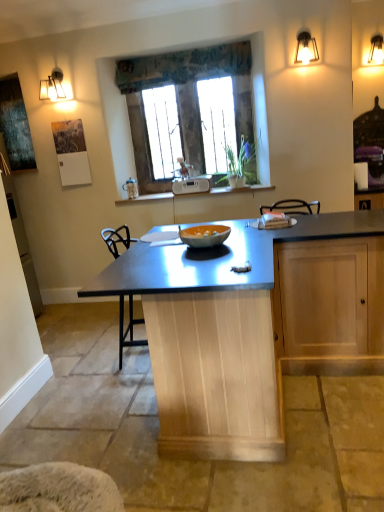
Question: Is stone textured window at center looking in the opposite direction of metallic wall sconce at upper right?

Choices:
 (A) yes
 (B) no

Answer: (B)

Question: Is stone textured window at center further to the viewer compared to metallic wall sconce at upper right?

Choices:
 (A) yes
 (B) no

Answer: (A)

Question: Is stone textured window at center thinner than metallic wall sconce at upper right?

Choices:
 (A) yes
 (B) no

Answer: (A)

Question: From a real-world perspective, does stone textured window at center sit lower than metallic wall sconce at upper right?

Choices:
 (A) yes
 (B) no

Answer: (A)

Question: Is stone textured window at center surrounding metallic wall sconce at upper right?

Choices:
 (A) yes
 (B) no

Answer: (B)

Question: From their relative heights in the image, would you say textured fabric valance at upper center is taller or shorter than white plastic radio at center?

Choices:
 (A) tall
 (B) short

Answer: (A)

Question: Based on their sizes in the image, would you say textured fabric valance at upper center is bigger or smaller than white plastic radio at center?

Choices:
 (A) small
 (B) big

Answer: (B)

Question: From a real-world perspective, relative to white plastic radio at center, is textured fabric valance at upper center vertically above or below?

Choices:
 (A) above
 (B) below

Answer: (A)

Question: In the image, is textured fabric valance at upper center positioned in front of or behind white plastic radio at center?

Choices:
 (A) behind
 (B) front

Answer: (B)

Question: In terms of size, does textured fabric valance at upper center appear bigger or smaller than orange matte glass bowl at center?

Choices:
 (A) small
 (B) big

Answer: (B)

Question: Considering the relative positions of textured fabric valance at upper center and orange matte glass bowl at center in the image provided, is textured fabric valance at upper center to the left or to the right of orange matte glass bowl at center?

Choices:
 (A) right
 (B) left

Answer: (B)

Question: Considering the positions of textured fabric valance at upper center and orange matte glass bowl at center in the image, is textured fabric valance at upper center taller or shorter than orange matte glass bowl at center?

Choices:
 (A) short
 (B) tall

Answer: (B)

Question: Would you say textured fabric valance at upper center is inside or outside orange matte glass bowl at center?

Choices:
 (A) outside
 (B) inside

Answer: (A)

Question: Is stone textured window at center bigger or smaller than metallic blue table at center?

Choices:
 (A) big
 (B) small

Answer: (B)

Question: Is point (230, 59) closer or farther from the camera than point (246, 238)?

Choices:
 (A) farther
 (B) closer

Answer: (A)